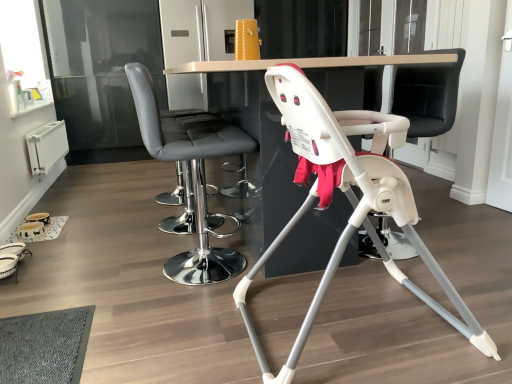
Question: Visually, is white plastic swivel chair at center positioned to the left or to the right of white plastic highchair at center, the second chair viewed from the left?

Choices:
 (A) right
 (B) left

Answer: (A)

Question: From the image's perspective, relative to white plastic highchair at center, which is the first chair in right-to-left order, is white plastic swivel chair at center above or below?

Choices:
 (A) below
 (B) above

Answer: (B)

Question: Estimate the real-world distances between objects in this image. Which object is farther from the white glossy table at center?

Choices:
 (A) matte gray bar stool at center, which ranks as the first chair in left-to-right order
 (B) white plastic swivel chair at center
 (C) white plastic highchair at center, the second chair viewed from the left

Answer: (B)

Question: Which object is positioned farthest from the white plastic highchair at center, which is the first chair in right-to-left order?

Choices:
 (A) white glossy table at center
 (B) white plastic swivel chair at center
 (C) matte gray bar stool at center, marked as the second chair in a right-to-left arrangement

Answer: (B)